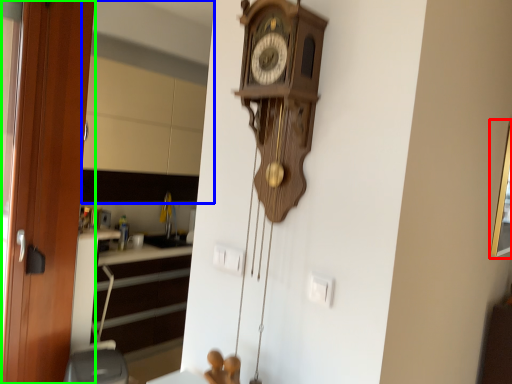
Question: Which object is positioned closest to picture frame (highlighted by a red box)? Select from mirror (highlighted by a blue box) and door (highlighted by a green box).

Choices:
 (A) mirror
 (B) door

Answer: (B)